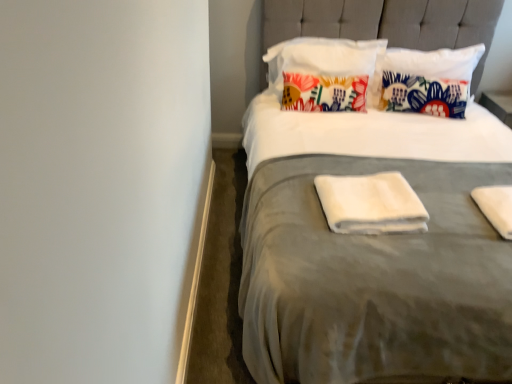
How much space does floral fabric pillow at upper center, which ranks as the 1th pillow in right-to-left order, occupy vertically?

The height of floral fabric pillow at upper center, which ranks as the 1th pillow in right-to-left order, is 20.75 inches.

Find the location of a particular element. The width and height of the screenshot is (512, 384). floral fabric pillow at upper center, acting as the 2th pillow starting from the left is located at coordinates (428, 80).

Locate an element on the screen. This screenshot has height=384, width=512. floral fabric pillow at upper center, marked as the 2th pillow in a right-to-left arrangement is located at coordinates (326, 73).

Find the location of a particular element. The image size is (512, 384). white soft towel at center, arranged as the second material when viewed from the right is located at coordinates (371, 204).

In terms of height, does floral fabric pillow at upper center, which ranks as the 1th pillow in right-to-left order, look taller or shorter compared to white soft towel at right, the 2th material in the left-to-right sequence?

Considering their sizes, floral fabric pillow at upper center, which ranks as the 1th pillow in right-to-left order, has more height than white soft towel at right, the 2th material in the left-to-right sequence.

Is floral fabric pillow at upper center, which ranks as the 1th pillow in right-to-left order, positioned in front of white soft towel at right, the 2th material in the left-to-right sequence?

That is False.

Based on the photo, can you tell me how much floral fabric pillow at upper center, which ranks as the 1th pillow in right-to-left order, and white soft towel at right, the 1th material positioned from the right, differ in facing direction?

The angular difference between floral fabric pillow at upper center, which ranks as the 1th pillow in right-to-left order, and white soft towel at right, the 1th material positioned from the right, is 2.86 degrees.

Which of these two, floral fabric pillow at upper center, acting as the 2th pillow starting from the left, or white soft towel at right, the 1th material positioned from the right, is bigger?

floral fabric pillow at upper center, acting as the 2th pillow starting from the left, is bigger.

Identify the location of material located behind the white soft towel at right, the 2th material in the left-to-right sequence. tap(371, 204).

Looking at this image, considering the relative sizes of white soft towel at right, the 2th material in the left-to-right sequence, and white soft towel at center, arranged as the second material when viewed from the right, in the image provided, is white soft towel at right, the 2th material in the left-to-right sequence, shorter than white soft towel at center, arranged as the second material when viewed from the right,?

Yes, white soft towel at right, the 2th material in the left-to-right sequence, is shorter than white soft towel at center, arranged as the second material when viewed from the right.

Which is more to the left, white soft towel at right, the 2th material in the left-to-right sequence, or white soft towel at center, the first material when ordered from left to right?

Positioned to the left is white soft towel at center, the first material when ordered from left to right.

Considering the sizes of objects white soft towel at right, the 2th material in the left-to-right sequence, and white soft towel at center, the first material when ordered from left to right, in the image provided, who is wider, white soft towel at right, the 2th material in the left-to-right sequence, or white soft towel at center, the first material when ordered from left to right,?

white soft towel at right, the 2th material in the left-to-right sequence.

Is white soft towel at center, arranged as the second material when viewed from the right, next to floral fabric pillow at upper center, marked as the 1th pillow in a left-to-right arrangement?

No, white soft towel at center, arranged as the second material when viewed from the right, is not touching floral fabric pillow at upper center, marked as the 1th pillow in a left-to-right arrangement.

The width and height of the screenshot is (512, 384). There is a floral fabric pillow at upper center, marked as the 2th pillow in a right-to-left arrangement. Find the location of `the 1st material below it (from a real-world perspective)`. the 1st material below it (from a real-world perspective) is located at coordinates (371, 204).

Which object is positioned more to the left, white soft towel at center, the first material when ordered from left to right, or floral fabric pillow at upper center, marked as the 2th pillow in a right-to-left arrangement?

Positioned to the left is floral fabric pillow at upper center, marked as the 2th pillow in a right-to-left arrangement.

Consider the image. From a real-world perspective, which object rests below the other?

white soft towel at center, arranged as the second material when viewed from the right, is physically lower.

Considering the points (399, 217) and (416, 103), which point is in front, point (399, 217) or point (416, 103)?

The point (399, 217) is closer.

Is white soft towel at center, the first material when ordered from left to right, smaller than floral fabric pillow at upper center, acting as the 2th pillow starting from the left?

Yes, white soft towel at center, the first material when ordered from left to right, is smaller than floral fabric pillow at upper center, acting as the 2th pillow starting from the left.

From the image's perspective, is white soft towel at center, the first material when ordered from left to right, above floral fabric pillow at upper center, which ranks as the 1th pillow in right-to-left order?

Actually, white soft towel at center, the first material when ordered from left to right, appears below floral fabric pillow at upper center, which ranks as the 1th pillow in right-to-left order, in the image.

Is floral fabric pillow at upper center, marked as the 2th pillow in a right-to-left arrangement, located outside floral fabric pillow at upper center, which ranks as the 1th pillow in right-to-left order?

That's correct, floral fabric pillow at upper center, marked as the 2th pillow in a right-to-left arrangement, is outside of floral fabric pillow at upper center, which ranks as the 1th pillow in right-to-left order.

Which point is more distant from viewer, (375, 104) or (451, 58)?

Point (451, 58)

Relative to floral fabric pillow at upper center, which ranks as the 1th pillow in right-to-left order, is floral fabric pillow at upper center, marked as the 2th pillow in a right-to-left arrangement, in front or behind?

Clearly, floral fabric pillow at upper center, marked as the 2th pillow in a right-to-left arrangement, is in front of floral fabric pillow at upper center, which ranks as the 1th pillow in right-to-left order.

From a real-world perspective, is floral fabric pillow at upper center, marked as the 2th pillow in a right-to-left arrangement, positioned above or below floral fabric pillow at upper center, which ranks as the 1th pillow in right-to-left order?

floral fabric pillow at upper center, marked as the 2th pillow in a right-to-left arrangement, is above floral fabric pillow at upper center, which ranks as the 1th pillow in right-to-left order.

Which object is further away from the camera taking this photo, floral fabric pillow at upper center, marked as the 1th pillow in a left-to-right arrangement, or white soft towel at right, the 1th material positioned from the right?

floral fabric pillow at upper center, marked as the 1th pillow in a left-to-right arrangement, is further away from the camera.

In the scene shown: Could you tell me if floral fabric pillow at upper center, marked as the 1th pillow in a left-to-right arrangement, is facing white soft towel at right, the 1th material positioned from the right?

Yes, floral fabric pillow at upper center, marked as the 1th pillow in a left-to-right arrangement, is oriented towards white soft towel at right, the 1th material positioned from the right.

This screenshot has width=512, height=384. I want to click on the 2nd pillow above the white soft towel at right, the 1th material positioned from the right (from the image's perspective), so click(326, 73).

From the picture: Considering the positions of objects white soft towel at center, the first material when ordered from left to right, and suede gray bed at center in the image provided, who is more to the right, white soft towel at center, the first material when ordered from left to right, or suede gray bed at center?

Positioned to the right is suede gray bed at center.

Which point is more forward, (339, 206) or (366, 307)?

The point (366, 307) is in front.

Does white soft towel at center, the first material when ordered from left to right, come in front of suede gray bed at center?

No, it is not.

Identify the location of the 2nd pillow behind when counting from the white soft towel at right, the 2th material in the left-to-right sequence. (428, 80).

Locate an element on the screen. This screenshot has width=512, height=384. material positioned vertically above the white soft towel at right, the 2th material in the left-to-right sequence (from a real-world perspective) is located at coordinates (371, 204).

When comparing their distances from floral fabric pillow at upper center, marked as the 2th pillow in a right-to-left arrangement, does white soft towel at right, the 1th material positioned from the right, or floral fabric pillow at upper center, which ranks as the 1th pillow in right-to-left order, seem closer?

The object closer to floral fabric pillow at upper center, marked as the 2th pillow in a right-to-left arrangement, is floral fabric pillow at upper center, which ranks as the 1th pillow in right-to-left order.

From the image, which object appears to be nearer to floral fabric pillow at upper center, marked as the 2th pillow in a right-to-left arrangement, floral fabric pillow at upper center, acting as the 2th pillow starting from the left, or white soft towel at right, the 1th material positioned from the right?

floral fabric pillow at upper center, acting as the 2th pillow starting from the left, is closer to floral fabric pillow at upper center, marked as the 2th pillow in a right-to-left arrangement.

Based on their spatial positions, is white soft towel at right, the 2th material in the left-to-right sequence, or suede gray bed at center closer to floral fabric pillow at upper center, marked as the 2th pillow in a right-to-left arrangement?

suede gray bed at center.

Based on their spatial positions, is floral fabric pillow at upper center, marked as the 1th pillow in a left-to-right arrangement, or white soft towel at center, the first material when ordered from left to right, further from white soft towel at right, the 1th material positioned from the right?

floral fabric pillow at upper center, marked as the 1th pillow in a left-to-right arrangement, is further to white soft towel at right, the 1th material positioned from the right.

Looking at the image, which one is located closer to floral fabric pillow at upper center, marked as the 1th pillow in a left-to-right arrangement, floral fabric pillow at upper center, which ranks as the 1th pillow in right-to-left order, or suede gray bed at center?

floral fabric pillow at upper center, which ranks as the 1th pillow in right-to-left order, is closer to floral fabric pillow at upper center, marked as the 1th pillow in a left-to-right arrangement.

Based on their spatial positions, is white soft towel at center, the first material when ordered from left to right, or white soft towel at right, the 1th material positioned from the right, further from floral fabric pillow at upper center, marked as the 2th pillow in a right-to-left arrangement?

Among the two, white soft towel at right, the 1th material positioned from the right, is located further to floral fabric pillow at upper center, marked as the 2th pillow in a right-to-left arrangement.

Which object lies further to the anchor point floral fabric pillow at upper center, marked as the 2th pillow in a right-to-left arrangement, suede gray bed at center or floral fabric pillow at upper center, which ranks as the 1th pillow in right-to-left order?

suede gray bed at center.

When comparing their distances from suede gray bed at center, does floral fabric pillow at upper center, acting as the 2th pillow starting from the left, or white soft towel at center, arranged as the second material when viewed from the right, seem further?

The object further to suede gray bed at center is floral fabric pillow at upper center, acting as the 2th pillow starting from the left.

Identify the location of material located between white soft towel at right, the 1th material positioned from the right, and floral fabric pillow at upper center, marked as the 1th pillow in a left-to-right arrangement, in the depth direction. (371, 204).

In order to click on material between suede gray bed at center and white soft towel at center, the first material when ordered from left to right, along the z-axis in this screenshot , I will do `click(496, 207)`.

At what (x,y) coordinates should I click in order to perform the action: click on pillow located between white soft towel at center, the first material when ordered from left to right, and floral fabric pillow at upper center, which ranks as the 1th pillow in right-to-left order, in the depth direction. Please return your answer as a coordinate pair (x, y). The width and height of the screenshot is (512, 384). Looking at the image, I should click on (326, 73).

Find the location of a particular element. This screenshot has height=384, width=512. pillow between suede gray bed at center and floral fabric pillow at upper center, which ranks as the 1th pillow in right-to-left order, in the front-back direction is located at coordinates (326, 73).